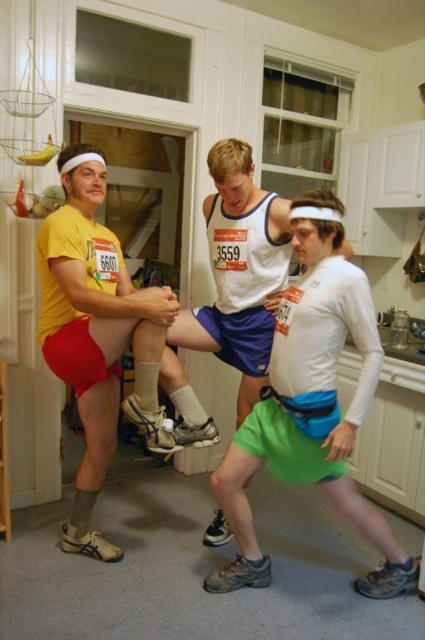
You are a photographer standing in the kitchen and want to take a photo of the green fabric shorts at center. You have a camera that requires you to be exactly 1.8 meters away from the subject to focus properly. Can you take the photo with your current position?

The green fabric shorts at center and camera are 1.77 meters apart, so you are 0.03 meters too close to focus properly. Move back slightly to achieve the required distance.